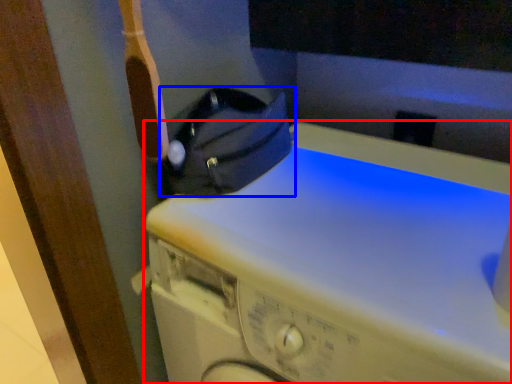
Question: Which object appears closest to the camera in this image, washing machine (highlighted by a red box) or bag (highlighted by a blue box)?

Choices:
 (A) washing machine
 (B) bag

Answer: (A)